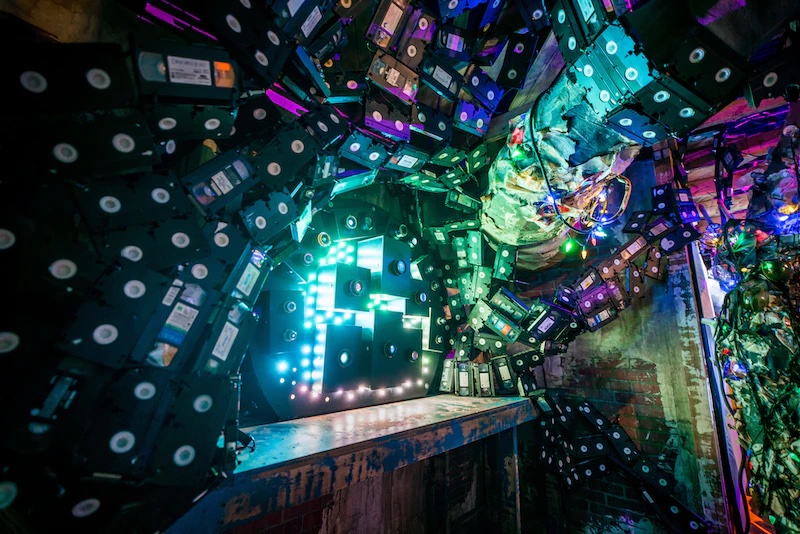
I want to click on vcr tapes on wall, so click(598, 445), click(72, 257), click(702, 57).